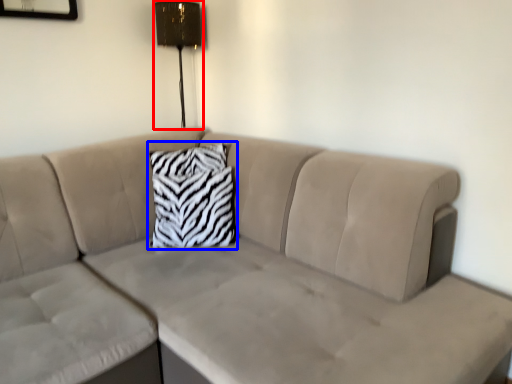
Question: Which of the following is the farthest to the observer, lamp (highlighted by a red box) or pillow (highlighted by a blue box)?

Choices:
 (A) lamp
 (B) pillow

Answer: (A)